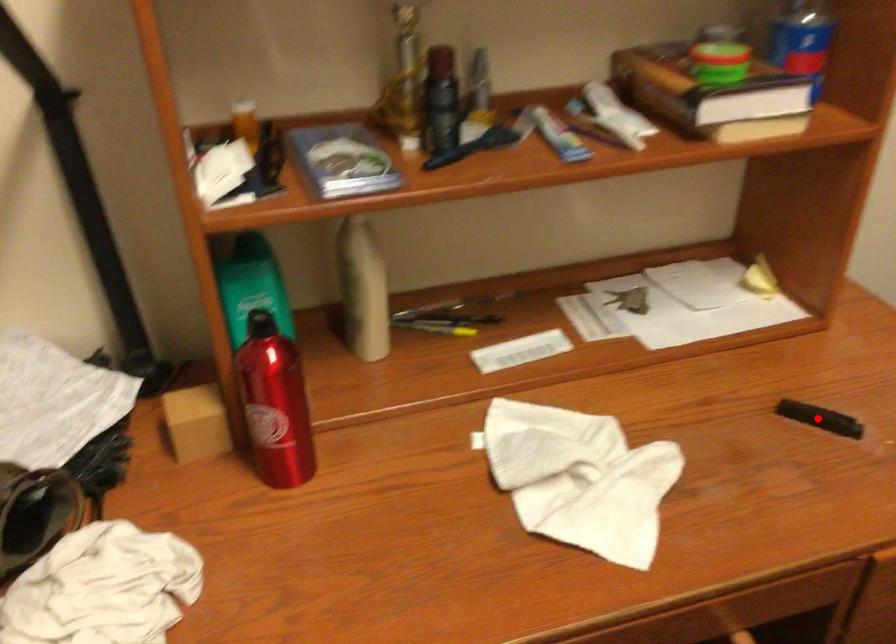
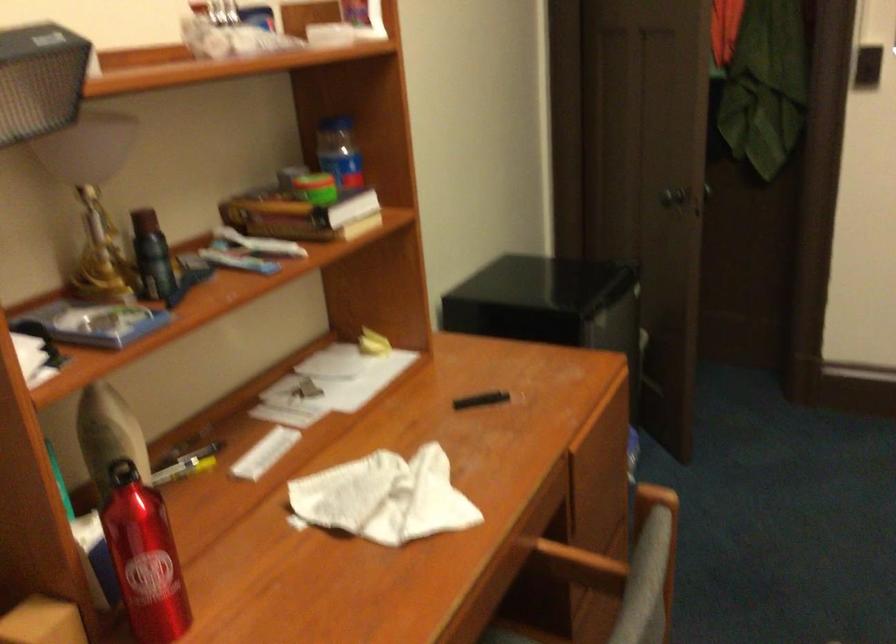
Find the pixel in the second image that matches the highlighted location in the first image.

(480, 400)